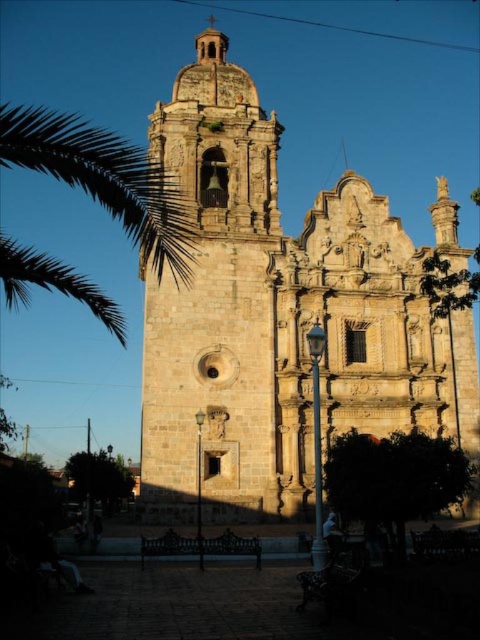
Question: Can you confirm if stone church at center is thinner than stone tower at center?

Choices:
 (A) no
 (B) yes

Answer: (A)

Question: Which of these objects is positioned closest to the green leafy palm at left?

Choices:
 (A) stone tower at center
 (B) stone church at center

Answer: (A)

Question: Considering the real-world distances, which object is closest to the stone church at center?

Choices:
 (A) stone tower at center
 (B) green leafy palm at left

Answer: (A)

Question: Can you confirm if stone church at center is thinner than stone tower at center?

Choices:
 (A) no
 (B) yes

Answer: (A)

Question: Does stone church at center appear under stone tower at center?

Choices:
 (A) no
 (B) yes

Answer: (B)

Question: Which point appears closest to the camera in this image?

Choices:
 (A) (159, 252)
 (B) (360, 358)

Answer: (A)